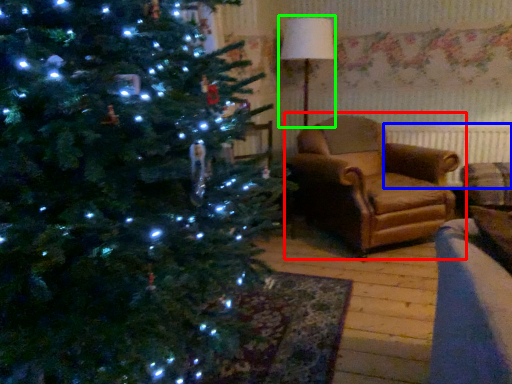
Question: Estimate the real-world distances between objects in this image. Which object is closer to studio couch (highlighted by a red box), radiator (highlighted by a blue box) or lamp (highlighted by a green box)?

Choices:
 (A) radiator
 (B) lamp

Answer: (A)